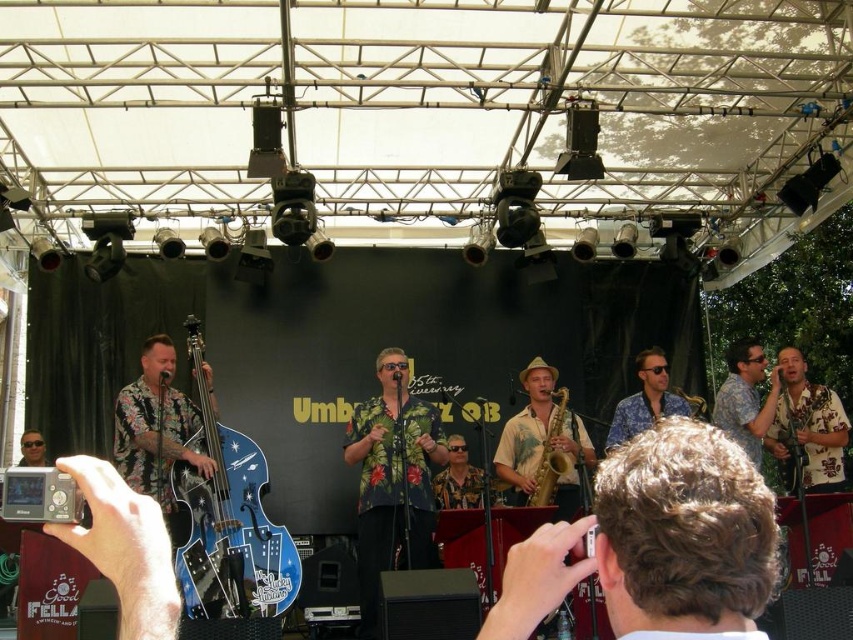
You are a photographer at the Umbria Jazz event. You want to capture a photo of both the floral shirt at center and the floral print shirt at center. Which one should you focus on first if you want to ensure the taller one is in frame?

The floral shirt at center is taller than the floral print shirt at center, so you should focus on the floral shirt at center first to ensure it is in frame.

You are a photographer at the Umbria Jazz event. You want to capture a photo where the blue glossy electric guitar at left and the floral fabric saxophone at center are both clearly visible. Given their sizes, which instrument should you focus on to ensure it fills more of the frame without cropping?

The blue glossy electric guitar at left is much taller than the floral fabric saxophone at center, so focusing on it will allow it to fill more of the frame without cropping.